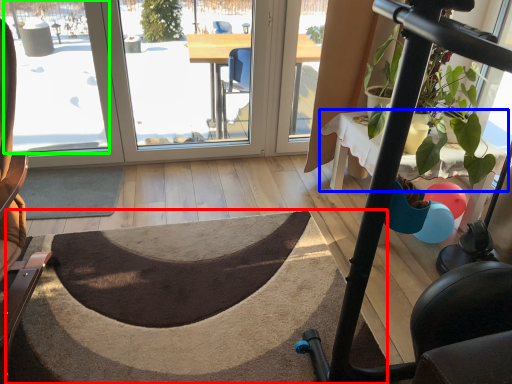
Question: Which object is the farthest from doormat (highlighted by a red box)? Choose among these: table (highlighted by a blue box) or window screen (highlighted by a green box).

Choices:
 (A) table
 (B) window screen

Answer: (B)